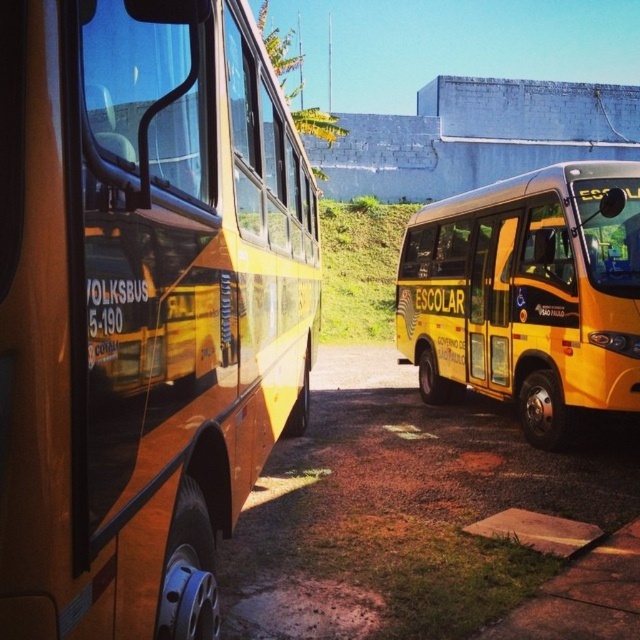
Question: Is yellow matte bus at center to the right of yellow matte bus at right from the viewer's perspective?

Choices:
 (A) yes
 (B) no

Answer: (B)

Question: Among these points, which one is nearest to the camera?

Choices:
 (A) (44, 388)
 (B) (628, 264)

Answer: (A)

Question: Is yellow matte bus at center closer to camera compared to yellow matte bus at right?

Choices:
 (A) no
 (B) yes

Answer: (B)

Question: Can you confirm if yellow matte bus at center is positioned below yellow matte bus at right?

Choices:
 (A) no
 (B) yes

Answer: (A)